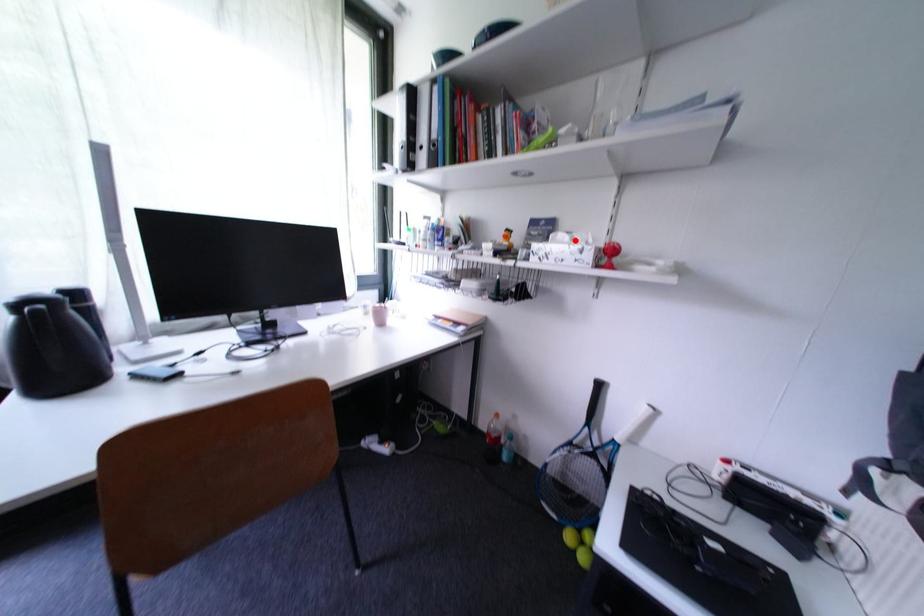
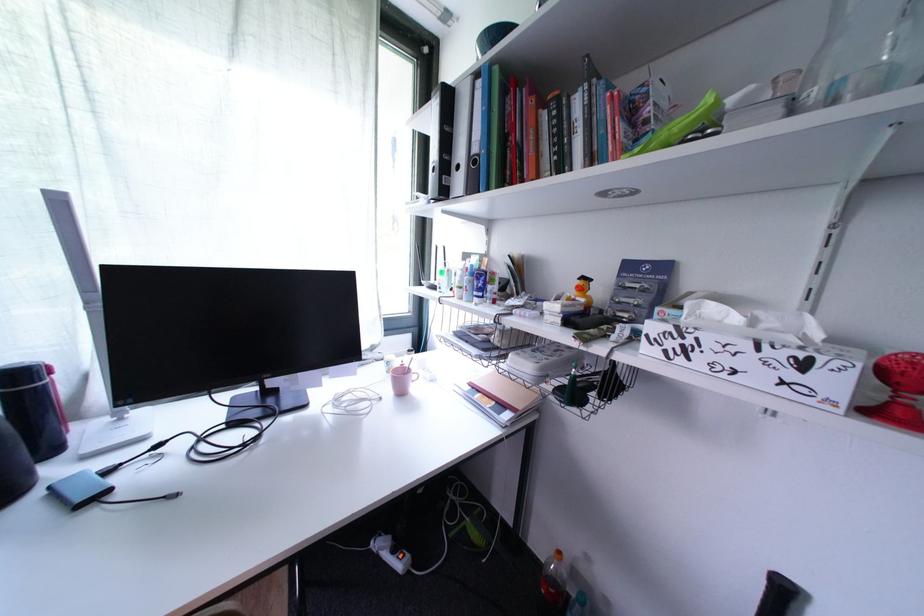
Where in the second image is the point corresponding to the highlighted location from the first image?

(745, 321)